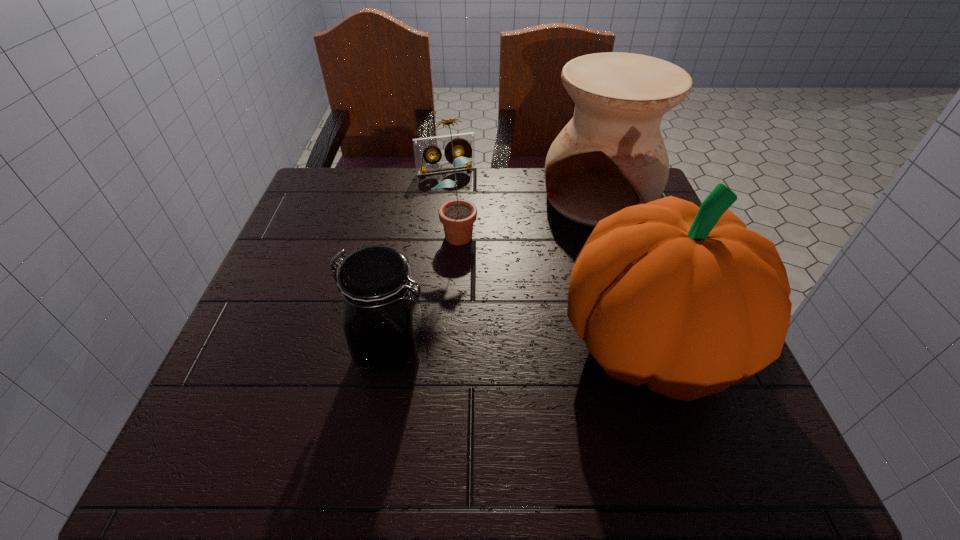
This screenshot has width=960, height=540. Identify the location of empty space between the fourth tallest object and the videotape. (419, 260).

Where is `vacant point located between the pottery and the second shortest object`? The image size is (960, 540). vacant point located between the pottery and the second shortest object is located at coordinates (494, 273).

You are a GUI agent. You are given a task and a screenshot of the screen. Output one action in this format:
    pyautogui.click(x=<x>, y=<y>)
    Task: Click on the vacant area that lies between the sunflower and the pumpkin
    
    Given the screenshot: What is the action you would take?
    pyautogui.click(x=553, y=287)

Where is `free space between the pumpkin and the second shortest object`? free space between the pumpkin and the second shortest object is located at coordinates (520, 347).

Identify the location of free space between the pottery and the videotape. (522, 185).

I want to click on vacant space that is in between the jar and the sunflower, so click(423, 289).

Locate an element on the screen. The height and width of the screenshot is (540, 960). vacant point located between the pumpkin and the sunflower is located at coordinates (553, 287).

Where is `vacant area that lies between the pumpkin and the sunflower`? The width and height of the screenshot is (960, 540). vacant area that lies between the pumpkin and the sunflower is located at coordinates (553, 287).

The width and height of the screenshot is (960, 540). I want to click on the closest object to the shortest object, so click(x=457, y=216).

Identify the location of object that is the fourth closest to the pumpkin. The image size is (960, 540). (465, 142).